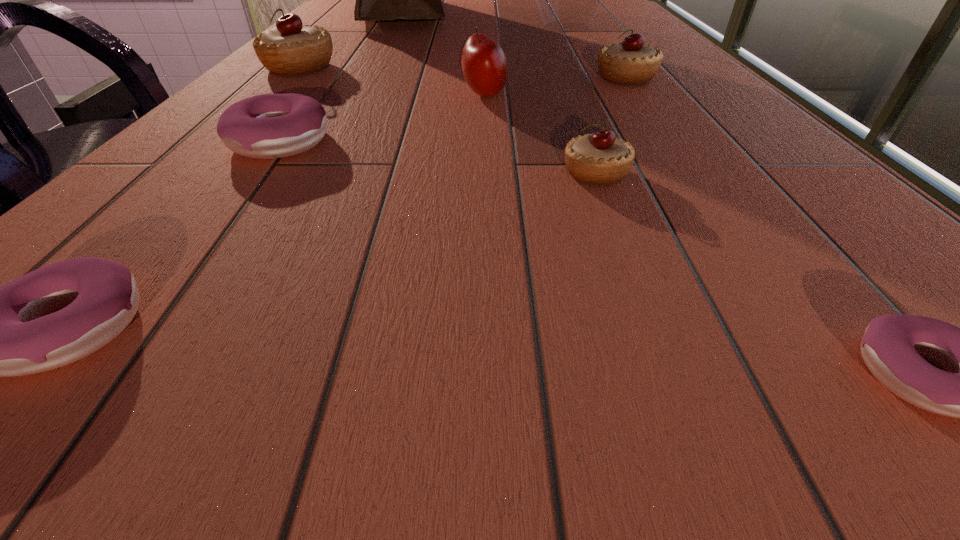
Where is `vacant space at the near right corner`? vacant space at the near right corner is located at coordinates (884, 408).

At what (x,y) coordinates should I click in order to perform the action: click on empty space that is in between the apple and the tallest pastry. Please return your answer as a coordinate pair (x, y). This screenshot has width=960, height=540. Looking at the image, I should click on (392, 82).

This screenshot has width=960, height=540. What are the coordinates of `vacant point located between the second tallest object and the apple` in the screenshot? It's located at (525, 61).

Identify the location of vacant area that lies between the second tallest object and the second biggest beige pastry. (596, 53).

What are the coordinates of `free space between the tallest pastry and the fourth pastry from left to right` in the screenshot? It's located at (447, 120).

Find the location of a particular element. The height and width of the screenshot is (540, 960). free point between the fifth tallest object and the tallest pastry is located at coordinates (463, 73).

Find the location of a particular element. This screenshot has width=960, height=540. vacant area that lies between the grocery bag and the apple is located at coordinates (443, 55).

Where is `object that is the eighth nearest to the fifth shortest object`? This screenshot has width=960, height=540. object that is the eighth nearest to the fifth shortest object is located at coordinates (60, 313).

This screenshot has width=960, height=540. What are the coordinates of `object that is the eighth closest to the fifth object from left to right` in the screenshot? It's located at point(892,345).

Where is `pastry that can be found as the closest to the farthest pink pastry`? This screenshot has width=960, height=540. pastry that can be found as the closest to the farthest pink pastry is located at coordinates (290, 48).